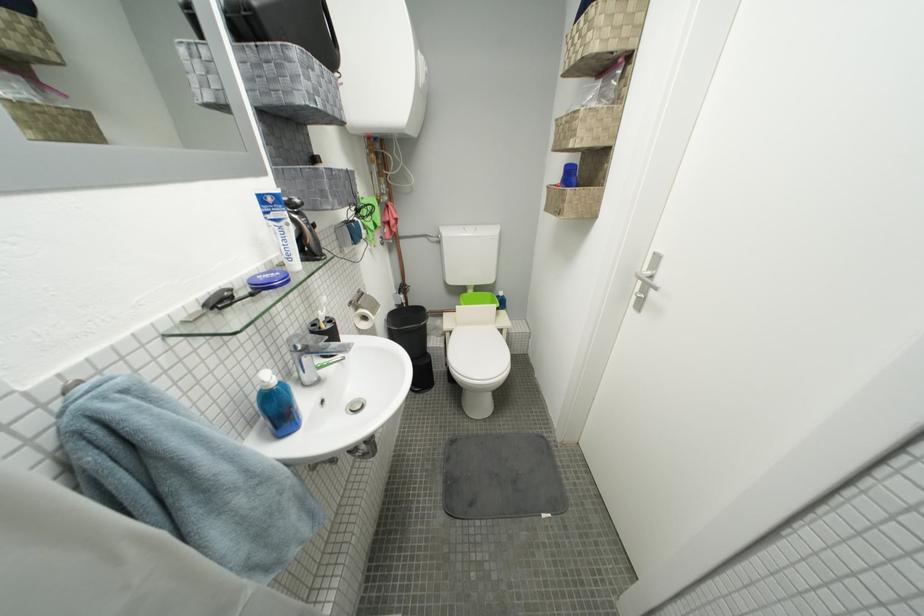
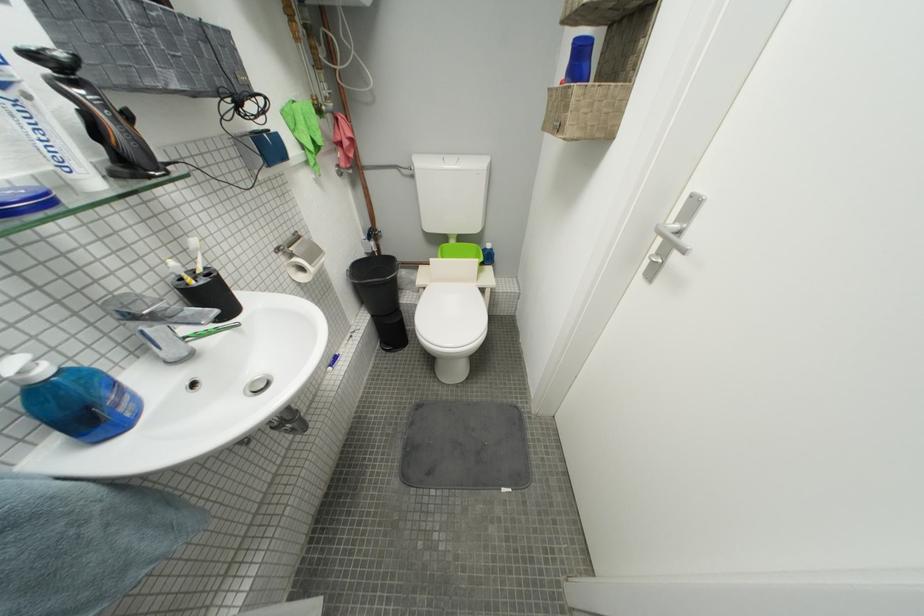
In the second image, find the point that corresponds to the point at 383,315 in the first image.

(320, 265)